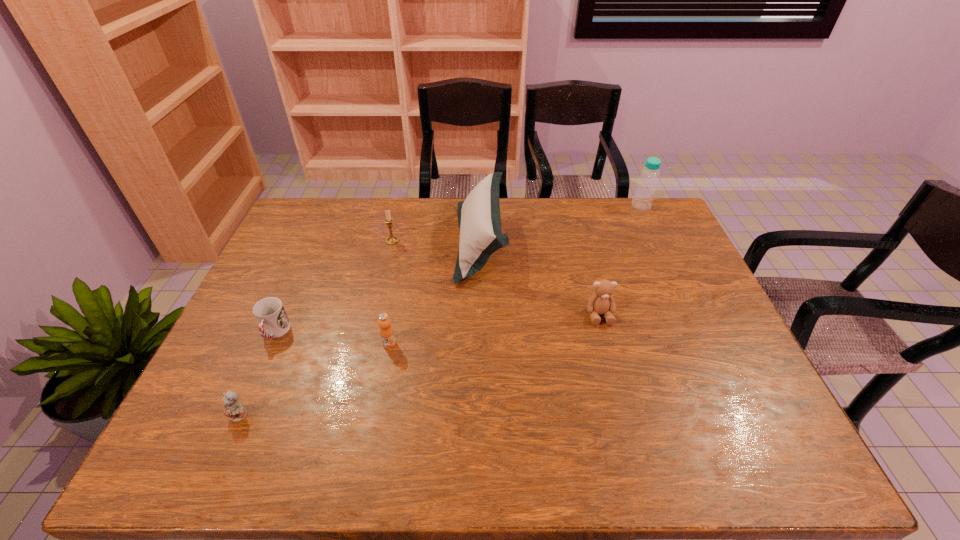
Locate an element on the screen. vacant space at the far right corner of the desktop is located at coordinates (647, 212).

The image size is (960, 540). I want to click on vacant space that is in between the orange juice and the fifth object from right to left, so click(x=391, y=292).

Where is `free space that is in between the third object from left to right and the cup`? This screenshot has width=960, height=540. free space that is in between the third object from left to right and the cup is located at coordinates [x=334, y=286].

Find the location of `free point between the cushion and the farther teddy bear`. free point between the cushion and the farther teddy bear is located at coordinates 540,279.

The width and height of the screenshot is (960, 540). I want to click on vacant point located between the third object from left to right and the cup, so pos(334,286).

Locate an element on the screen. This screenshot has height=540, width=960. vacant space that is in between the nearer teddy bear and the candle holder is located at coordinates pos(316,328).

I want to click on free space between the bottle and the nearer teddy bear, so click(x=441, y=310).

Where is `vacant space in between the left teddy bear and the cup`? Image resolution: width=960 pixels, height=540 pixels. vacant space in between the left teddy bear and the cup is located at coordinates (257, 374).

Find the location of a particular element. free space between the fifth object from right to left and the cup is located at coordinates (334, 286).

Locate an element on the screen. vacant space that is in between the nearer teddy bear and the right teddy bear is located at coordinates (420, 365).